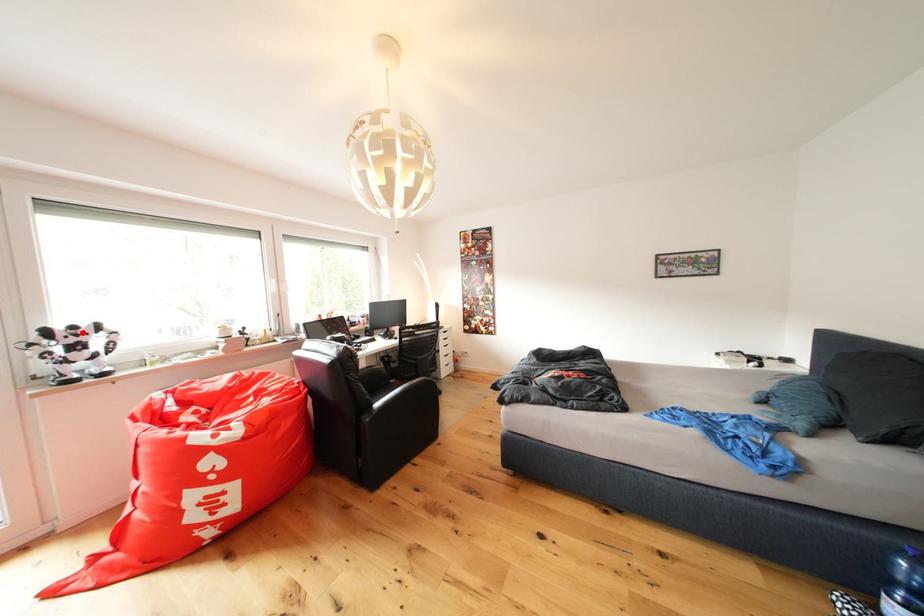
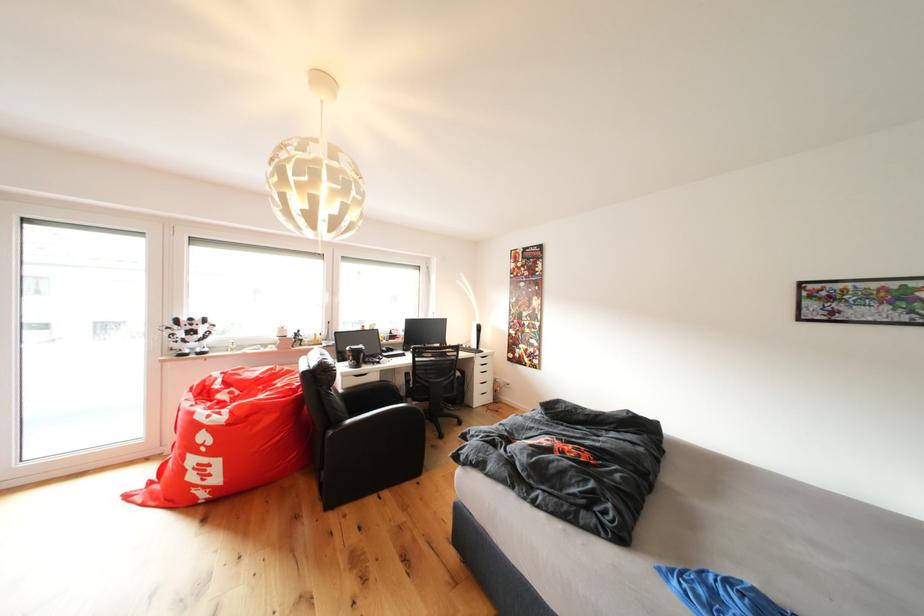
Where in the second image is the point corresponding to the highlighted location from the first image?

(200, 323)